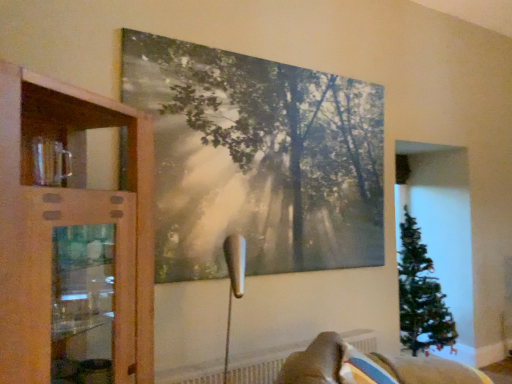
Question: Would you say wooden cabinet at left is to the left or to the right of velvet beige sofa at lower right in the picture?

Choices:
 (A) left
 (B) right

Answer: (A)

Question: From the image's perspective, relative to velvet beige sofa at lower right, is wooden cabinet at left above or below?

Choices:
 (A) above
 (B) below

Answer: (A)

Question: Based on their relative distances, which object is farther from the wooden cabinet at left?

Choices:
 (A) white textured radiator at lower center
 (B) velvet beige sofa at lower right
 (C) matte canvas painting at upper center

Answer: (B)

Question: Considering the real-world distances, which object is closest to the velvet beige sofa at lower right?

Choices:
 (A) matte canvas painting at upper center
 (B) wooden cabinet at left
 (C) white textured radiator at lower center

Answer: (C)